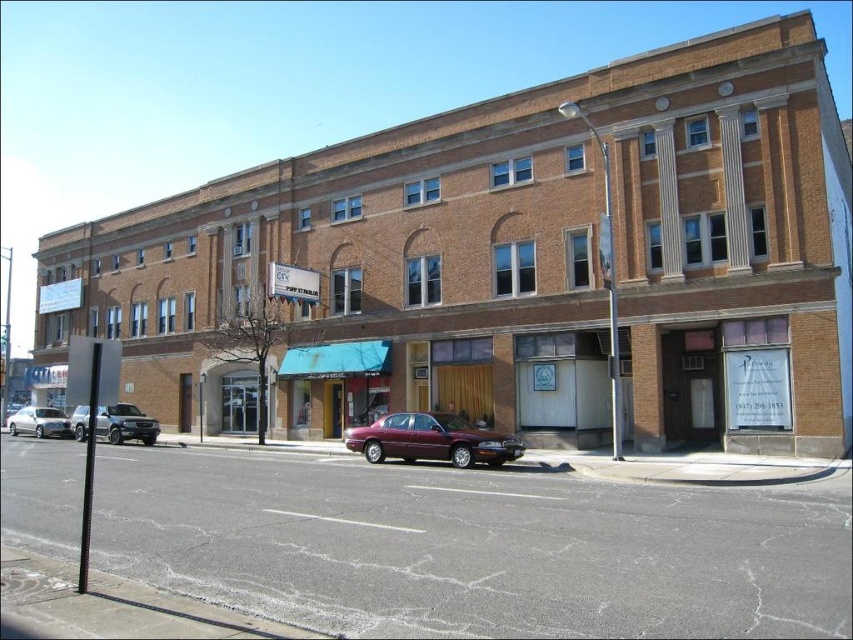
Question: Does maroon metallic sedan at center lie in front of silver metallic sedan at left?

Choices:
 (A) no
 (B) yes

Answer: (B)

Question: Which point appears farthest from the camera in this image?

Choices:
 (A) (115, 422)
 (B) (409, 442)

Answer: (A)

Question: Can you confirm if satin silver suv at left is smaller than silver metallic sedan at left?

Choices:
 (A) yes
 (B) no

Answer: (B)

Question: Among these points, which one is farthest from the camera?

Choices:
 (A) (149, 440)
 (B) (432, 444)

Answer: (A)

Question: Among these objects, which one is nearest to the camera?

Choices:
 (A) silver metallic sedan at left
 (B) maroon metallic sedan at center

Answer: (B)

Question: Is satin silver suv at left below silver metallic sedan at left?

Choices:
 (A) yes
 (B) no

Answer: (B)